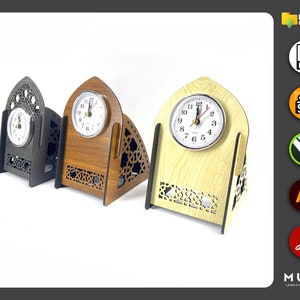
Locate an element on the screen. This screenshot has height=300, width=300. 1 brown clock is located at coordinates (101, 166).